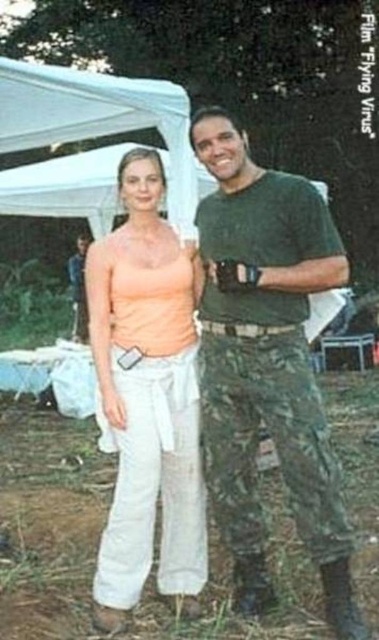
You are planning to take a photo of the green camouflage pants at right and the matte peach tank top at center. To ensure both are in focus, you need to know which one is taller. Can you tell me which object is taller?

The green camouflage pants at right is taller than the matte peach tank top at center.

You are planning to take a photo of the two people in the scene. You want to ensure that both the green camouflage pants at right and the matte peach tank top at center are clearly visible. Given their sizes, which one might you need to adjust your camera focus on more carefully to ensure clarity?

The green camouflage pants at right is bigger than the matte peach tank top at center, so you might need to focus more carefully on the matte peach tank top at center to ensure it is clearly visible in the photo.

You are planning to buy a new pair of pants and a top for an outdoor event. The store has a limited stock. You need to know which item is wider between the green camouflage pants at right and the matte peach tank top at center to ensure they fit properly. Which one is wider?

The green camouflage pants at right is wider than the matte peach tank top at center according to the description.